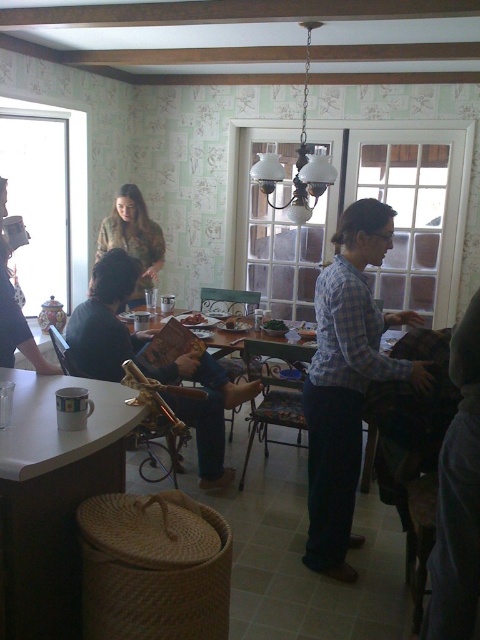
Is the position of blue plaid shirt at center more distant than that of matte brown book at center?

No, blue plaid shirt at center is in front of matte brown book at center.

Is blue plaid shirt at center above matte brown book at center?

No, blue plaid shirt at center is not above matte brown book at center.

Who is more forward, (364, 292) or (212, 483)?

Point (364, 292) is more forward.

I want to click on blue plaid shirt at center, so [x=347, y=381].

How far apart are blue plaid shirt at center and woodenmaterial/texturetable at center?

A distance of 82.55 centimeters exists between blue plaid shirt at center and woodenmaterial/texturetable at center.

Measure the distance from blue plaid shirt at center to woodenmaterial/texturetable at center.

blue plaid shirt at center is 82.55 centimeters from woodenmaterial/texturetable at center.

Which is behind, point (339, 531) or point (408, 323)?

The point (408, 323) is more distant.

At what (x,y) coordinates should I click in order to perform the action: click on blue plaid shirt at center. Please return your answer as a coordinate pair (x, y). Looking at the image, I should click on (347, 381).

Which of these two, white matte table at lower left or smooth brown bread at center, stands shorter?

smooth brown bread at center

Identify the location of white matte table at lower left. This screenshot has width=480, height=640. click(x=54, y=497).